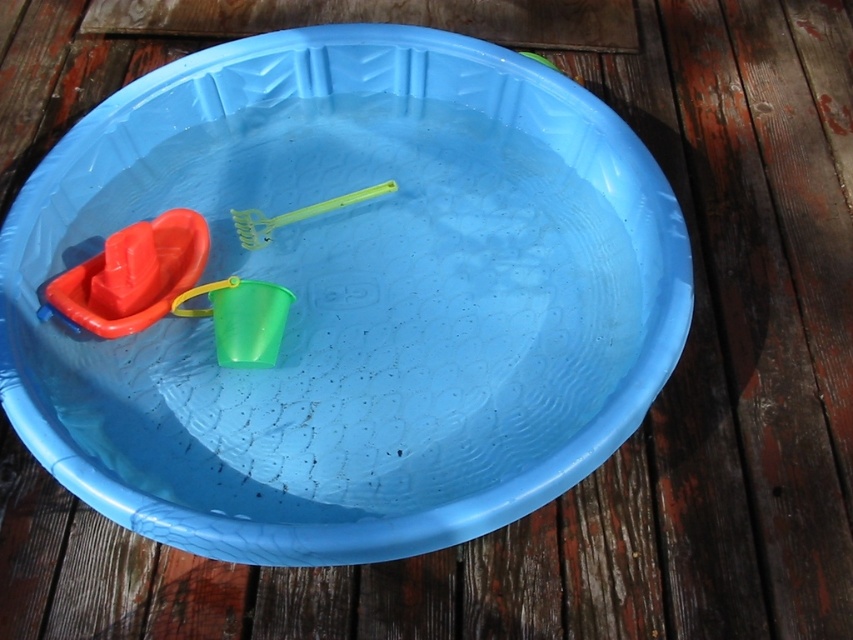
Question: Which point is closer to the camera?

Choices:
 (A) matte plastic boat at left
 (B) translucent green bucket at center
 (C) green plastic rake at center
 (D) blue plastic bowl at center

Answer: (D)

Question: Can you confirm if translucent green bucket at center is positioned above green plastic rake at center?

Choices:
 (A) no
 (B) yes

Answer: (A)

Question: Does translucent green bucket at center come in front of green plastic rake at center?

Choices:
 (A) yes
 (B) no

Answer: (A)

Question: Which point is farther from the camera taking this photo?

Choices:
 (A) (250, 461)
 (B) (160, 282)
 (C) (282, 289)

Answer: (B)

Question: Which point is farther from the camera taking this photo?

Choices:
 (A) (457, 131)
 (B) (218, 300)

Answer: (A)

Question: Is blue plastic bowl at center below translucent green bucket at center?

Choices:
 (A) yes
 (B) no

Answer: (B)